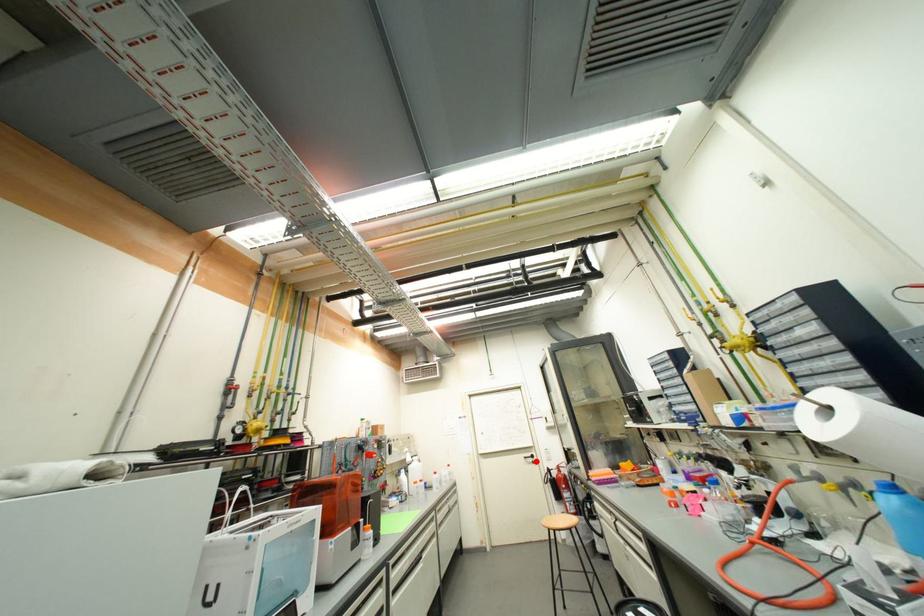
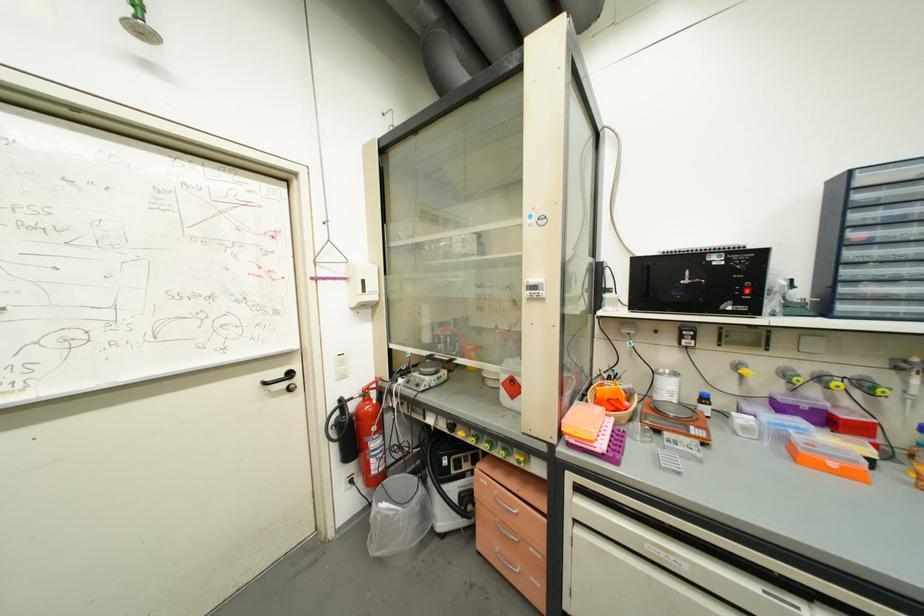
Question: I am providing you with two images of the same scene from different viewpoints. Given a red point in image1, look at the same physical point in image2. Is it:

Choices:
 (A) Closer to the viewpoint
 (B) Farther from the viewpoint

Answer: (A)